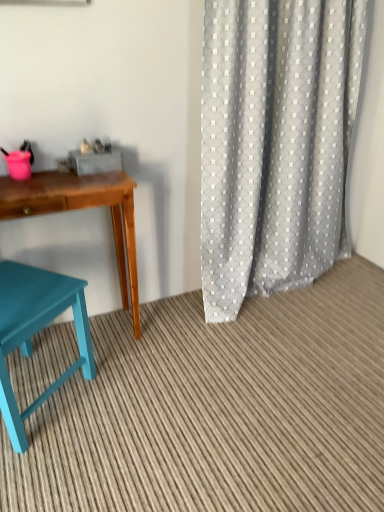
Question: Is gray textured curtain at right positioned with its back to teal wood desk at left?

Choices:
 (A) no
 (B) yes

Answer: (A)

Question: Is gray textured curtain at right positioned in front of teal wood desk at left?

Choices:
 (A) yes
 (B) no

Answer: (A)

Question: From a real-world perspective, is gray textured curtain at right physically above teal wood desk at left?

Choices:
 (A) no
 (B) yes

Answer: (B)

Question: Does gray textured curtain at right appear on the right side of teal wood desk at left?

Choices:
 (A) yes
 (B) no

Answer: (A)

Question: Is gray textured curtain at right far away from teal wood desk at left?

Choices:
 (A) yes
 (B) no

Answer: (B)

Question: Does gray textured curtain at right have a lesser height compared to teal wood desk at left?

Choices:
 (A) yes
 (B) no

Answer: (B)

Question: Is teal wood stool at lower left bigger than teal painted wood chair at lower left?

Choices:
 (A) no
 (B) yes

Answer: (A)

Question: From the image's perspective, does teal wood stool at lower left appear lower than teal painted wood chair at lower left?

Choices:
 (A) no
 (B) yes

Answer: (B)

Question: Is teal wood stool at lower left touching teal painted wood chair at lower left?

Choices:
 (A) no
 (B) yes

Answer: (A)

Question: Does teal wood stool at lower left appear on the right side of teal painted wood chair at lower left?

Choices:
 (A) no
 (B) yes

Answer: (B)

Question: Is teal wood stool at lower left positioned far away from teal painted wood chair at lower left?

Choices:
 (A) no
 (B) yes

Answer: (A)

Question: From the image's perspective, is teal wood stool at lower left over teal painted wood chair at lower left?

Choices:
 (A) no
 (B) yes

Answer: (A)

Question: From a real-world perspective, is teal wood stool at lower left located beneath teal wood desk at left?

Choices:
 (A) no
 (B) yes

Answer: (B)